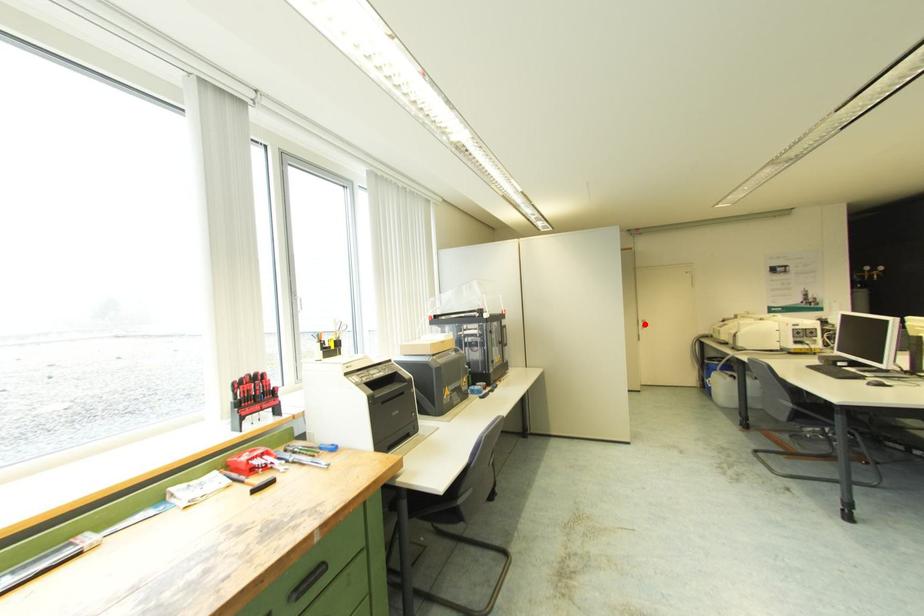
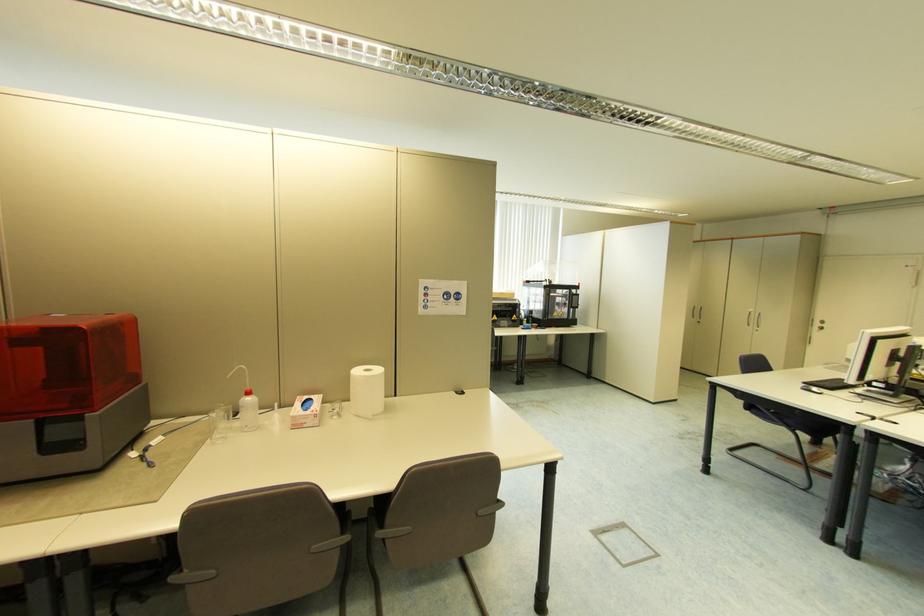
Question: I am providing you with two images of the same scene from different viewpoints. Given a red point in image1, look at the same physical point in image2. Is it:

Choices:
 (A) Closer to the viewpoint
 (B) Farther from the viewpoint

Answer: (B)